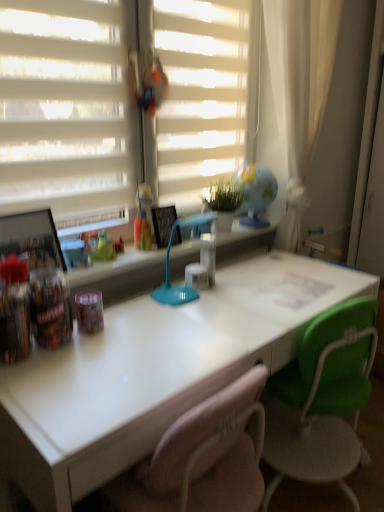
Locate an element on the screen. The width and height of the screenshot is (384, 512). vacant point above white glossy desk at center (from a real-world perspective) is located at coordinates (213, 310).